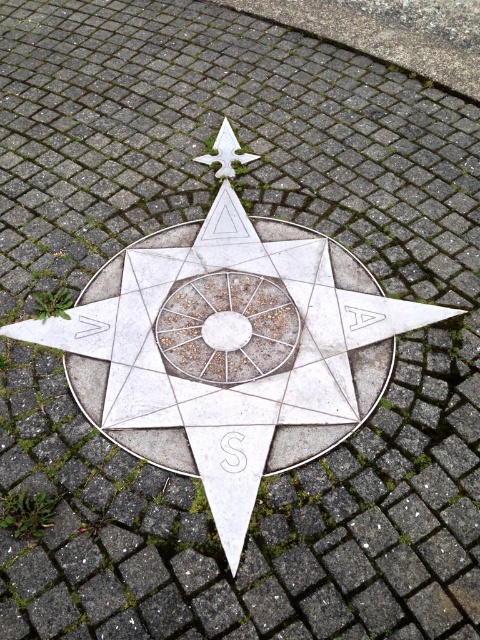
Question: Is metallic textured circle at center positioned in front of white metal star at upper center?

Choices:
 (A) yes
 (B) no

Answer: (A)

Question: Which object is closer to the camera taking this photo?

Choices:
 (A) metallic textured circle at center
 (B) white metal star at upper center

Answer: (A)

Question: Does metallic textured circle at center appear over white metal star at upper center?

Choices:
 (A) yes
 (B) no

Answer: (B)

Question: Among these objects, which one is farthest from the camera?

Choices:
 (A) metallic textured circle at center
 (B) white metal star at upper center

Answer: (B)

Question: Can you confirm if metallic textured circle at center is positioned to the left of white metal star at upper center?

Choices:
 (A) no
 (B) yes

Answer: (A)